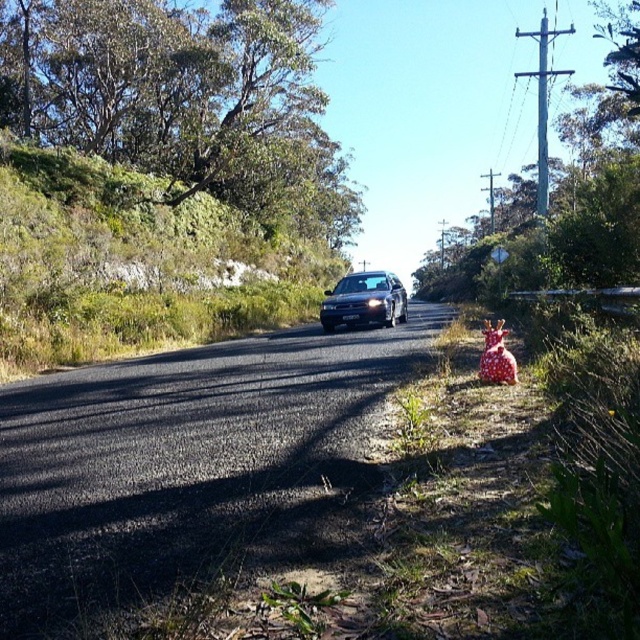
You are a driver approaching the black asphalt road at center and the satin black sedan at center. Which object appears smaller in the scene?

The black asphalt road at center appears smaller than the satin black sedan at center.

You are standing at the point marked by the coordinates point (186, 464). Looking ahead along the road, which direction does the road curve towards?

The road curves gently to the right as it stretches into the distance.

You are driving a satin black sedan at center and want to turn around on the black asphalt road at center. Is the road wide enough for a U turn?

The black asphalt road at center is narrower than the satin black sedan at center, so it is not wide enough to perform a U turn safely.